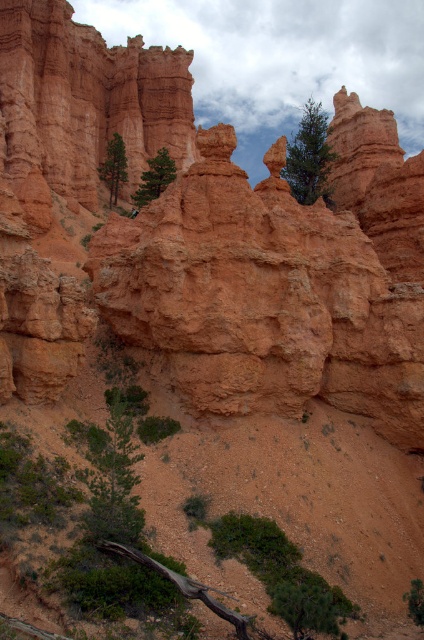
You are an explorer in the desert and see the green matte tree at upper center and the green leafy tree at lower right. Which tree is taller?

The green matte tree at upper center is taller than the green leafy tree at lower right.

You are a hiker who wants to take a photo of both the green matte tree at upper center and the green leafy tree at lower right. Which tree should you focus on first to ensure both are in the frame?

You should focus on the green leafy tree at lower right first because the green matte tree at upper center is closer to you, so adjusting focus from the closer tree to the farther one will help ensure both are in the frame.